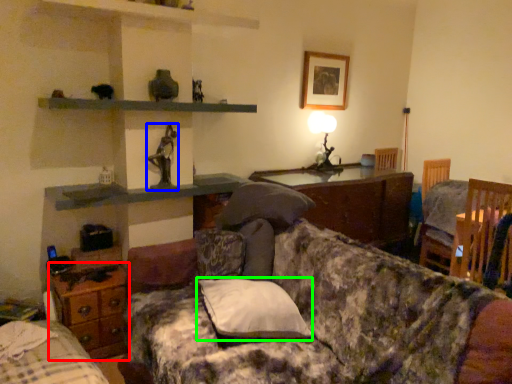
Question: Considering the real-world distances, which object is farthest from table (highlighted by a red box)? person (highlighted by a blue box) or pillow (highlighted by a green box)?

Choices:
 (A) person
 (B) pillow

Answer: (B)